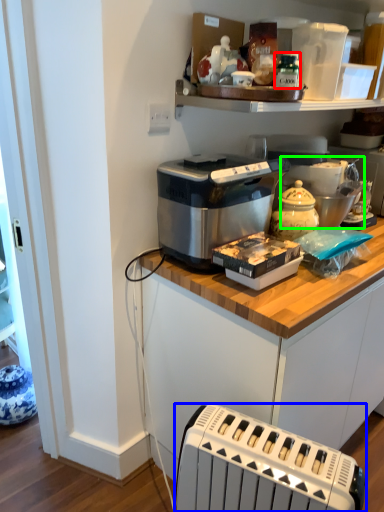
Question: Which object is positioned farthest from bottle (highlighted by a red box)? Select from toaster (highlighted by a blue box) and appliance (highlighted by a green box).

Choices:
 (A) toaster
 (B) appliance

Answer: (A)